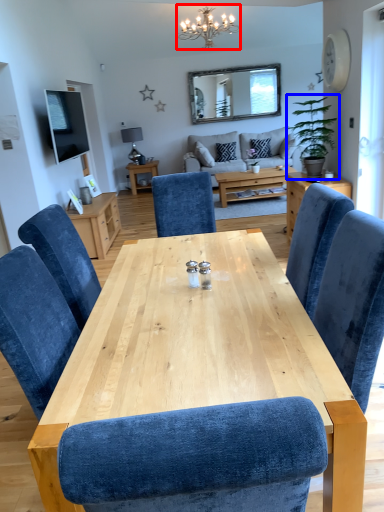
Question: Which object is further to the camera taking this photo, light fixture (highlighted by a red box) or houseplant (highlighted by a blue box)?

Choices:
 (A) light fixture
 (B) houseplant

Answer: (A)